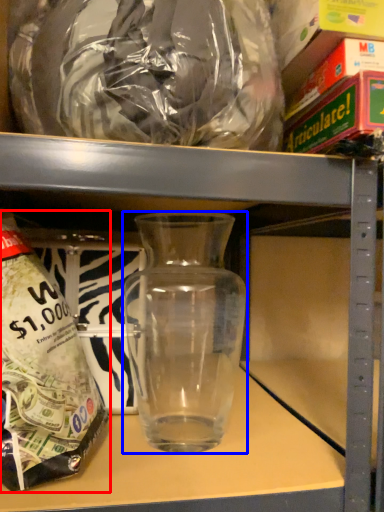
Question: Among these objects, which one is nearest to the camera, bottle (highlighted by a red box) or vase (highlighted by a blue box)?

Choices:
 (A) bottle
 (B) vase

Answer: (A)